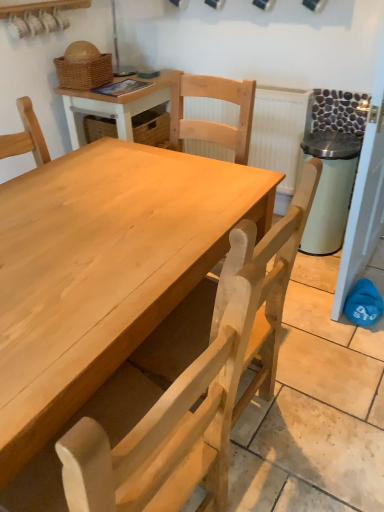
Question: From their relative heights in the image, would you say natural wood chair at center is taller or shorter than woven brown basket at upper left?

Choices:
 (A) tall
 (B) short

Answer: (A)

Question: Is point pos(135,489) closer or farther from the camera than point pos(59,81)?

Choices:
 (A) farther
 (B) closer

Answer: (B)

Question: Considering the real-world distances, which object is farthest from the woven brown basket at upper left?

Choices:
 (A) natural wood chair at center
 (B) white textured radiator at upper center
 (C) wooden table at center

Answer: (A)

Question: Estimate the real-world distances between objects in this image. Which object is closer to the wooden table at center?

Choices:
 (A) white textured radiator at upper center
 (B) natural wood chair at center
 (C) woven brown basket at upper left

Answer: (C)